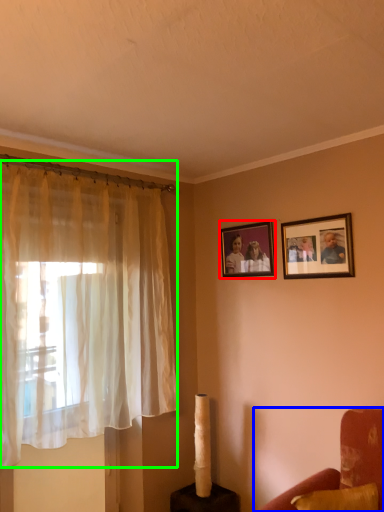
Question: Which object is positioned farthest from picture frame (highlighted by a red box)? Select from furniture (highlighted by a blue box) and curtain (highlighted by a green box).

Choices:
 (A) furniture
 (B) curtain

Answer: (A)